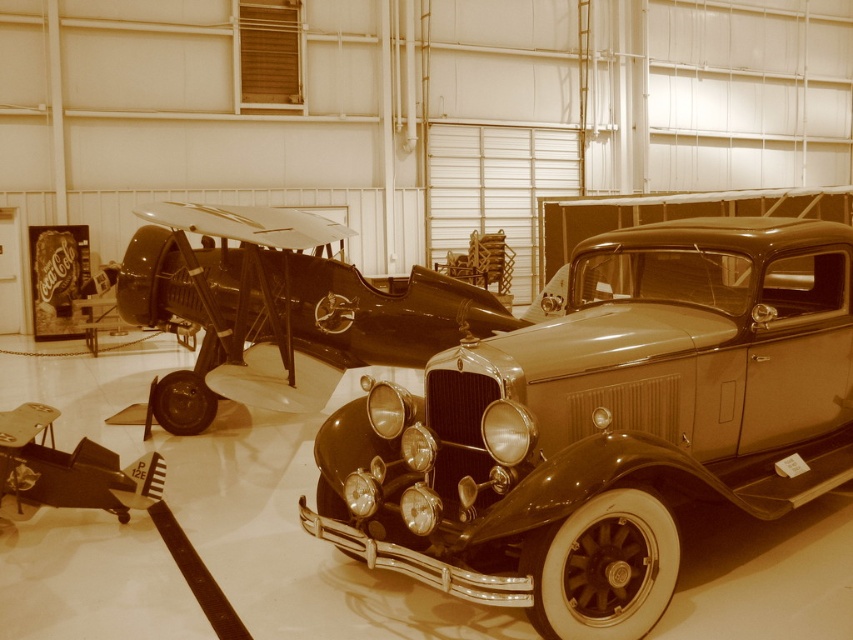
Question: Is shiny black car at center closer to the viewer compared to metallic silver car at center?

Choices:
 (A) yes
 (B) no

Answer: (A)

Question: In this image, where is shiny black car at center located relative to shiny black airplane at center?

Choices:
 (A) left
 (B) right

Answer: (B)

Question: Which point appears farthest from the camera in this image?

Choices:
 (A) (692, 472)
 (B) (480, 289)

Answer: (B)

Question: Which point is closer to the camera taking this photo?

Choices:
 (A) (160, 417)
 (B) (746, 448)
 (C) (68, 499)

Answer: (B)

Question: Estimate the real-world distances between objects in this image. Which object is closer to the shiny black car at center?

Choices:
 (A) metallic silver car at center
 (B) shiny black airplane at center

Answer: (A)

Question: Observing the image, what is the correct spatial positioning of shiny black airplane at center in reference to metallic silver car at center?

Choices:
 (A) left
 (B) right

Answer: (B)